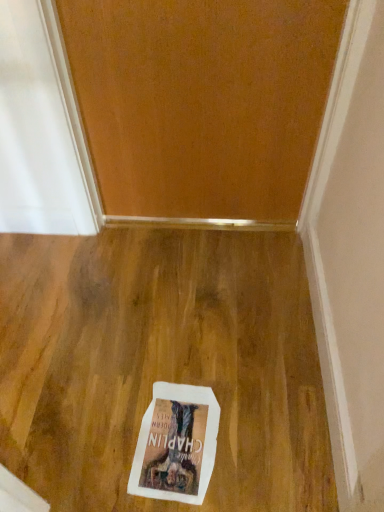
Where is `vacant region under white paper postcard at center (from a real-world perspective)`? vacant region under white paper postcard at center (from a real-world perspective) is located at coordinates (167, 432).